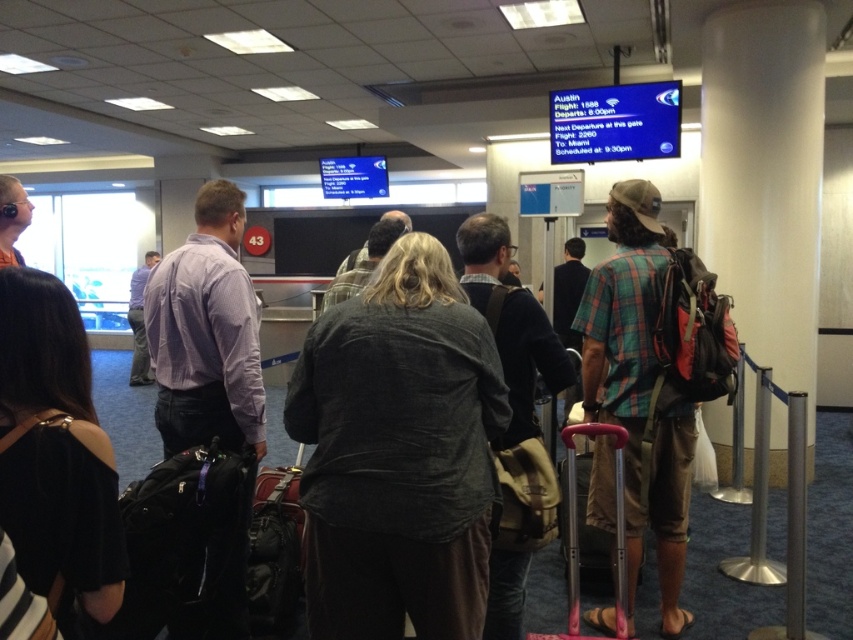
Does point (682, 465) lie behind point (570, 538)?

Yes, point (682, 465) is farther from viewer.

Does plaid shirt at center have a lesser height compared to metallic pink suitcase at center?

No.

Does point (619, 257) come closer to viewer compared to point (569, 484)?

That is False.

Identify the location of plaid shirt at center. (637, 388).

Based on the photo, can you confirm if dark gray linen shirt at center is thinner than plaid shirt at center?

In fact, dark gray linen shirt at center might be wider than plaid shirt at center.

Does dark gray linen shirt at center have a smaller size compared to plaid shirt at center?

Yes.

Does point (347, 540) come closer to viewer compared to point (639, 276)?

Yes, it is.

I want to click on dark gray linen shirt at center, so click(398, 452).

Does leather suitcase at center appear on the left side of metallic pink suitcase at center?

Correct, you'll find leather suitcase at center to the left of metallic pink suitcase at center.

Does leather suitcase at center have a greater width compared to metallic pink suitcase at center?

Incorrect, leather suitcase at center's width does not surpass metallic pink suitcase at center's.

Which is in front, point (293, 545) or point (589, 531)?

Positioned in front is point (293, 545).

I want to click on leather suitcase at center, so click(x=274, y=552).